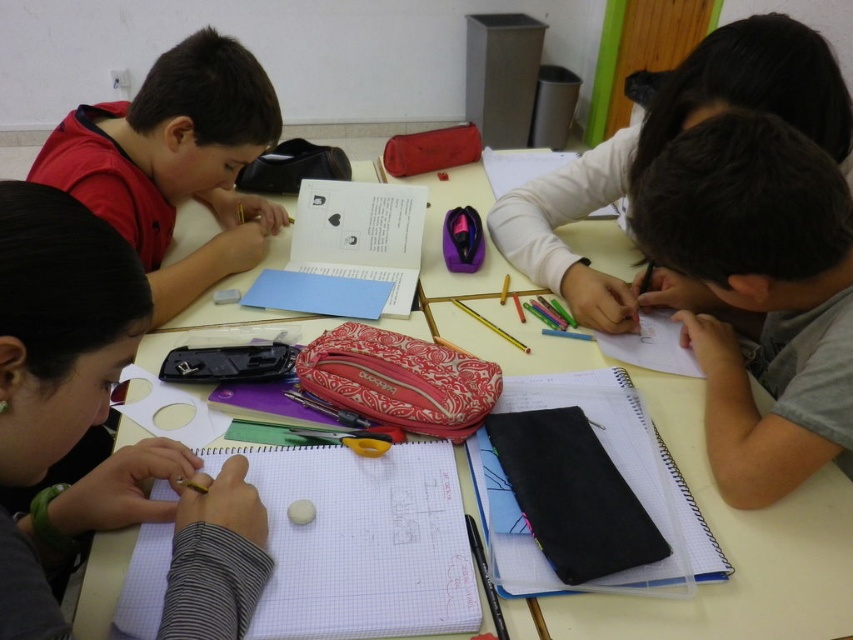
Question: Is gray matte notebook at lower right below white paper notebook at center?

Choices:
 (A) yes
 (B) no

Answer: (B)

Question: Which point appears farthest from the camera in this image?

Choices:
 (A) (706, 172)
 (B) (798, 605)
 (C) (608, 312)
 (D) (556, 428)

Answer: (C)

Question: Among these points, which one is farthest from the camera?

Choices:
 (A) (804, 330)
 (B) (556, 513)

Answer: (A)

Question: Which object is the closest to the matte gray pencil at upper right?

Choices:
 (A) gray matte notebook at lower right
 (B) white paper at lower left
 (C) white paper notebook at center

Answer: (A)

Question: Is matte black pencil at left further to camera compared to black leather notebook at center?

Choices:
 (A) yes
 (B) no

Answer: (B)

Question: Does gray matte notebook at lower right have a larger size compared to black leather notebook at center?

Choices:
 (A) yes
 (B) no

Answer: (A)